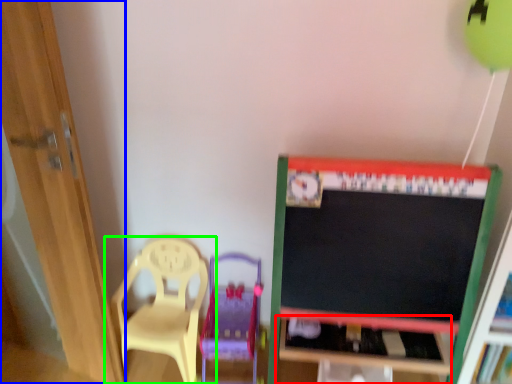
Question: Considering the real-world distances, which object is closest to table (highlighted by a red box)? door (highlighted by a blue box) or chair (highlighted by a green box).

Choices:
 (A) door
 (B) chair

Answer: (B)